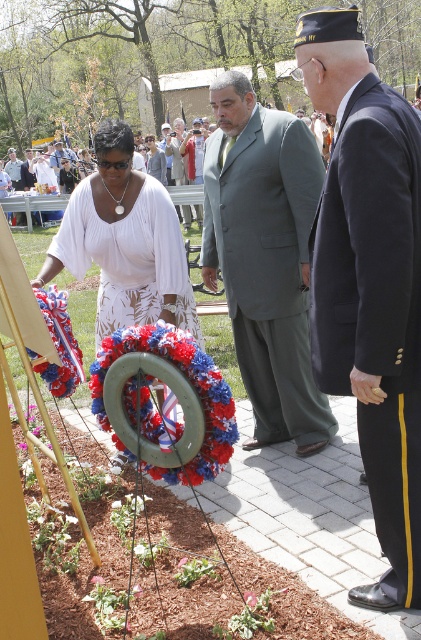
Is gray suit at center wider than light blue fabric shirt at center?

No.

Is gray suit at center positioned behind light blue fabric shirt at center?

No, it is in front of light blue fabric shirt at center.

Who is more distant from viewer, [269,435] or [10,163]?

The point [10,163] is more distant.

The height and width of the screenshot is (640, 421). In order to click on gray suit at center in this screenshot , I will do `click(264, 257)`.

Which of these two, black wool suit at right or light gray suit at center, stands shorter?

With less height is light gray suit at center.

Does black wool suit at right appear over light gray suit at center?

No.

Is point (384, 337) farther from viewer compared to point (175, 182)?

No, (384, 337) is in front of (175, 182).

Where is `black wool suit at right`? This screenshot has height=640, width=421. black wool suit at right is located at coordinates tap(375, 310).

What do you see at coordinates (375, 310) in the screenshot? I see `black wool suit at right` at bounding box center [375, 310].

Does point (402, 224) come farther from viewer compared to point (88, 184)?

That is False.

Where is `black wool suit at right`? The image size is (421, 640). black wool suit at right is located at coordinates (375, 310).